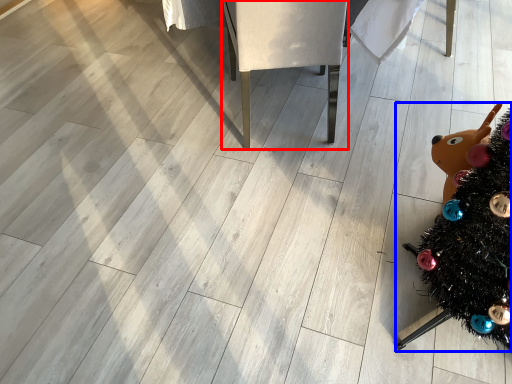
Question: Which object is closer to the camera taking this photo, furniture (highlighted by a red box) or christmas tree (highlighted by a blue box)?

Choices:
 (A) furniture
 (B) christmas tree

Answer: (B)